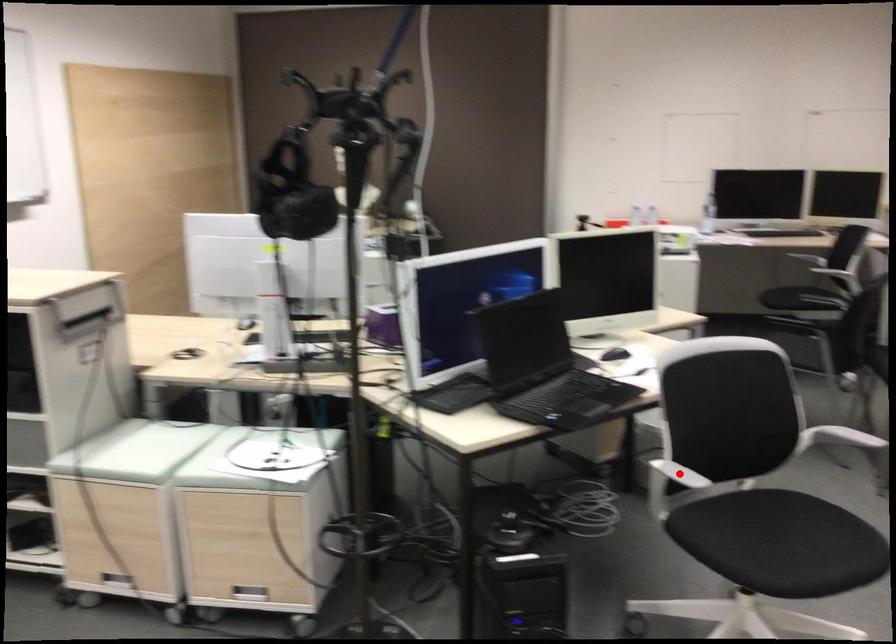
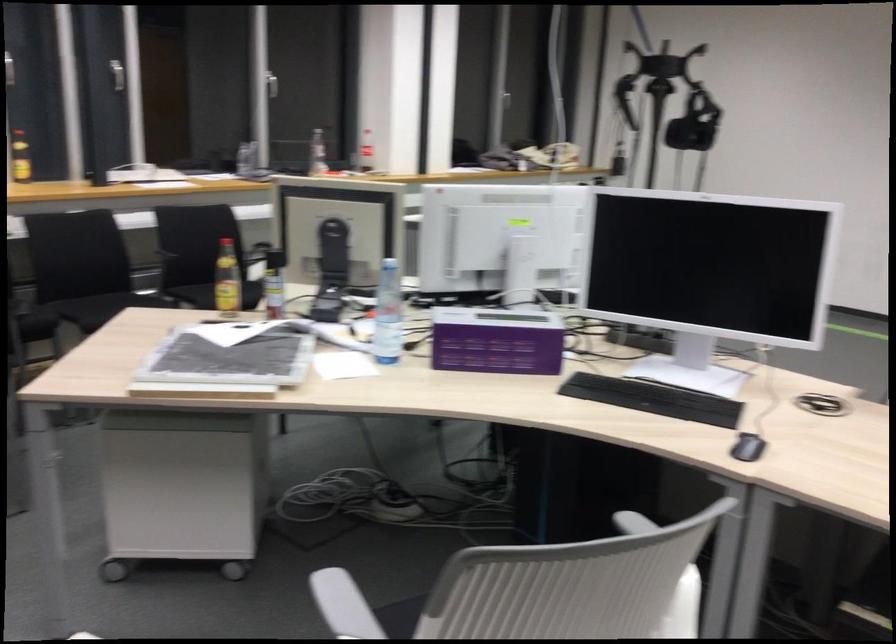
Question: I am providing you with two images of the same scene from different viewpoints. A red point is marked on the first image. Can you still see the location of the red point in image 2?

Choices:
 (A) Yes
 (B) No

Answer: (B)